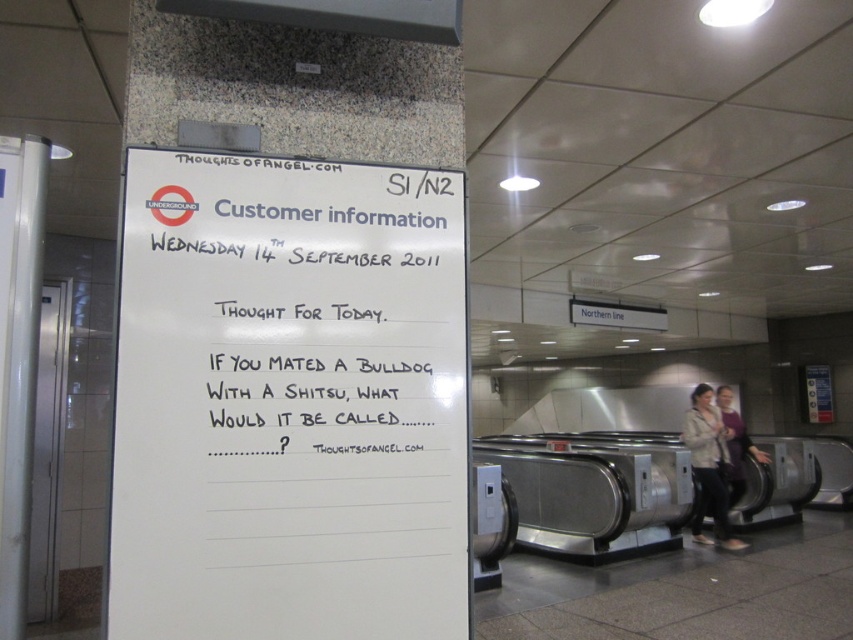
Question: Observing the image, what is the correct spatial positioning of white paper at upper left in reference to light beige jacket at lower right?

Choices:
 (A) left
 (B) right

Answer: (A)

Question: Does white paper at upper left have a smaller size compared to light beige jacket at lower right?

Choices:
 (A) yes
 (B) no

Answer: (A)

Question: Can you confirm if white paper at upper left is bigger than light beige jacket at lower right?

Choices:
 (A) no
 (B) yes

Answer: (A)

Question: Which point is farther from the camera taking this photo?

Choices:
 (A) (723, 454)
 (B) (331, 349)

Answer: (A)

Question: Which point is farther from the camera taking this photo?

Choices:
 (A) (358, 388)
 (B) (723, 426)

Answer: (B)